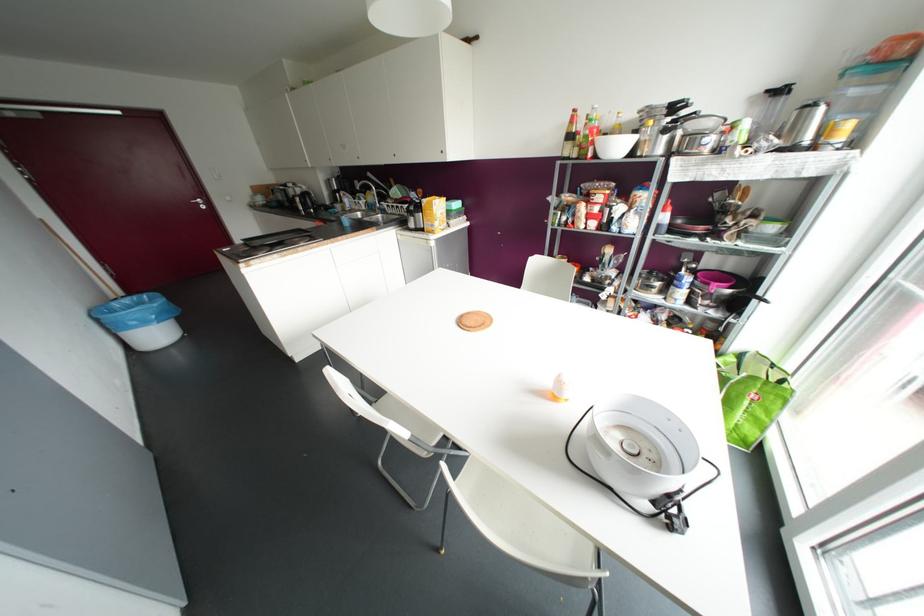
Describe the element at coordinates (679, 103) in the screenshot. I see `the black pan handle` at that location.